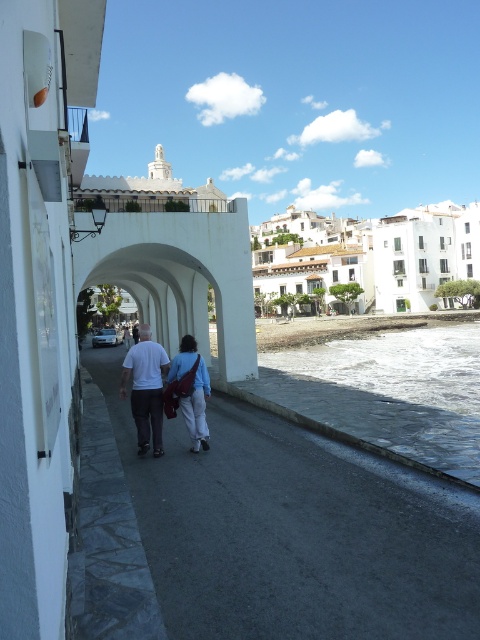
You are standing on the walkway and want to take a photo of both the white matte bridge at center and the blue fabric bag at center. Which object should you focus on first to ensure both are in the frame?

You should focus on the white matte bridge at center first because it is closer to you than the blue fabric bag at center, ensuring both are in the frame.

You are a delivery person carrying a box that is 2 meters long. You need to transport it from the gray concrete pavement at center to the white matte bridge at center. Is there enough space between them to move the box without tilting it sideways?

The gray concrete pavement at center and white matte bridge at center are 6.89 meters apart from each other. Since the box is 2 meters long, there is sufficient space to move it without tilting sideways as the distance between them is more than enough for the box length.